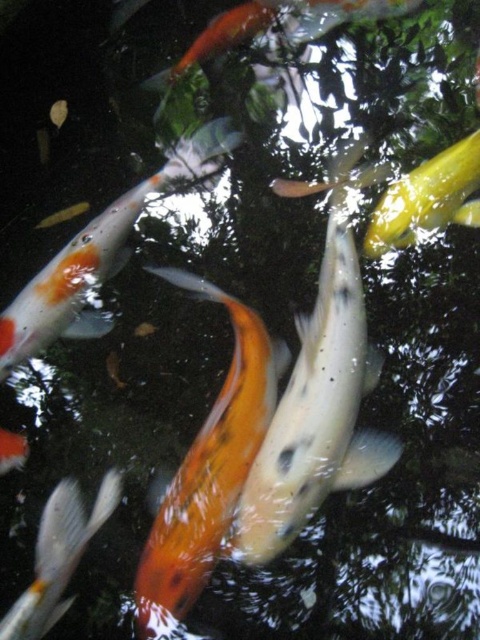
Question: Which of the following is the farthest from the observer?

Choices:
 (A) (402, 241)
 (B) (140, 624)
 (C) (355, 420)
 (D) (35, 620)

Answer: (A)

Question: Which object is the farthest from the orange and white speckled fish at lower left?

Choices:
 (A) shiny gold fish at upper right
 (B) orange and white speckled fish at center
 (C) shiny orange fish at center

Answer: (A)

Question: Where is orange and white speckled fish at center located in relation to shiny gold fish at upper right in the image?

Choices:
 (A) right
 (B) left

Answer: (B)

Question: Can you confirm if speckled white fish at center is wider than shiny gold fish at upper right?

Choices:
 (A) yes
 (B) no

Answer: (A)

Question: Does shiny orange fish at center have a smaller size compared to orange and white speckled fish at center?

Choices:
 (A) no
 (B) yes

Answer: (A)

Question: Which of the following is the closest to the observer?

Choices:
 (A) shiny gold fish at upper right
 (B) orange and white speckled fish at center

Answer: (B)